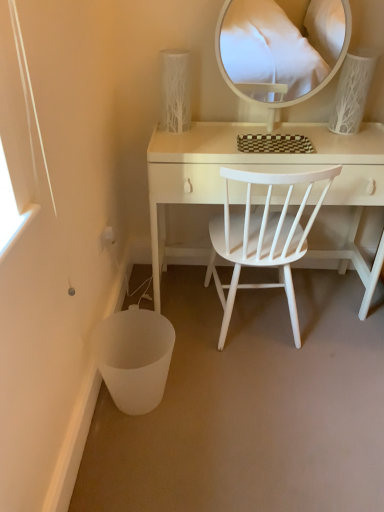
Find the location of a particular element. The image size is (384, 512). vacant area that is situated to the right of white textured vase at upper center, which ranks as the 1th table lamp in left-to-right order is located at coordinates (221, 130).